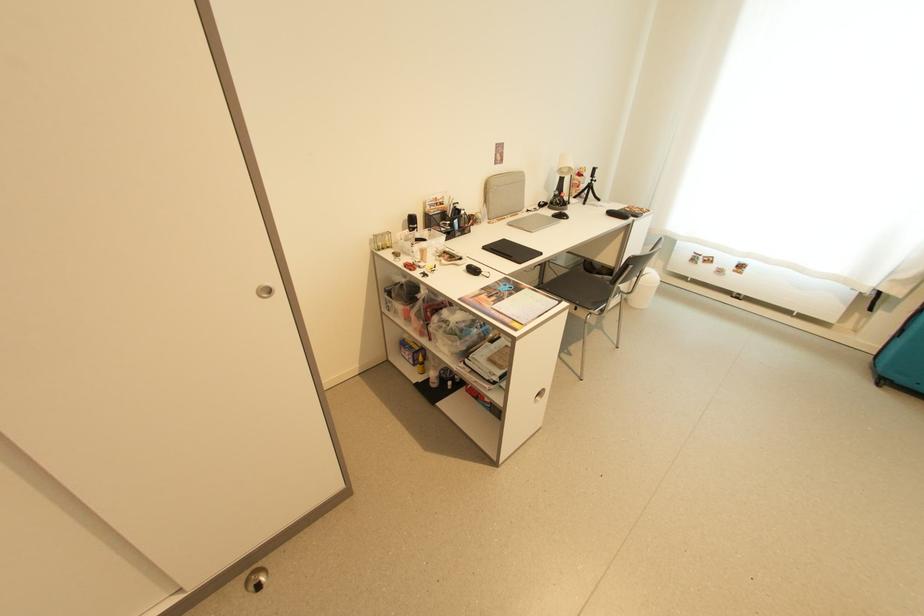
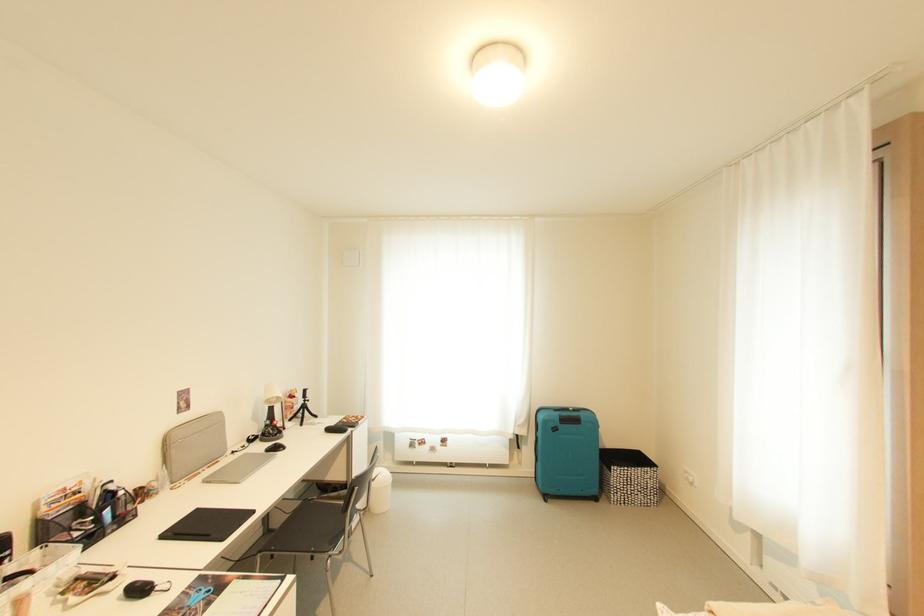
Find the pixel in the second image that matches the point at 508,241 in the first image.

(202, 512)